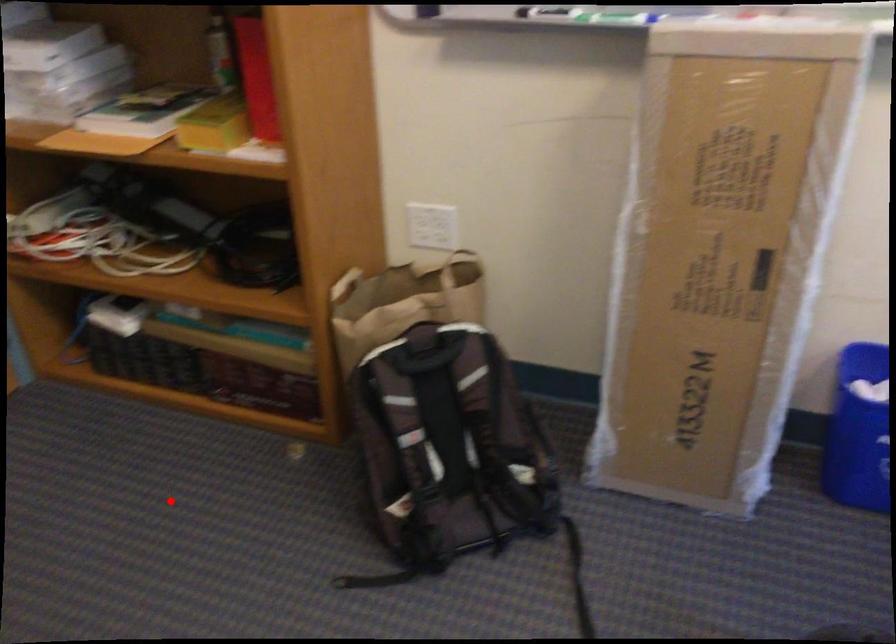
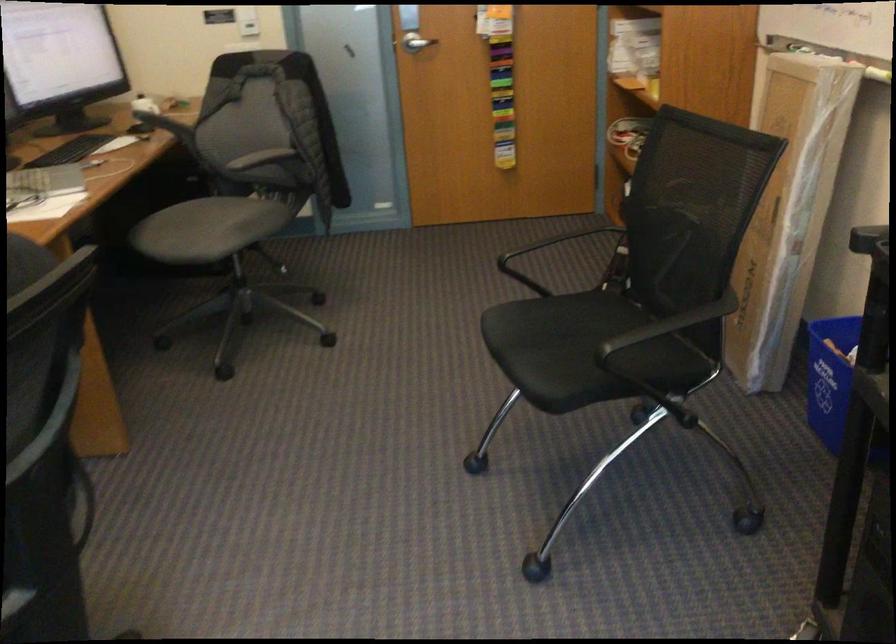
Question: I am providing you with two images of the same scene from different viewpoints. Given a red point in image1, look at the same physical point in image2. Is it:

Choices:
 (A) Closer to the viewpoint
 (B) Farther from the viewpoint

Answer: (B)